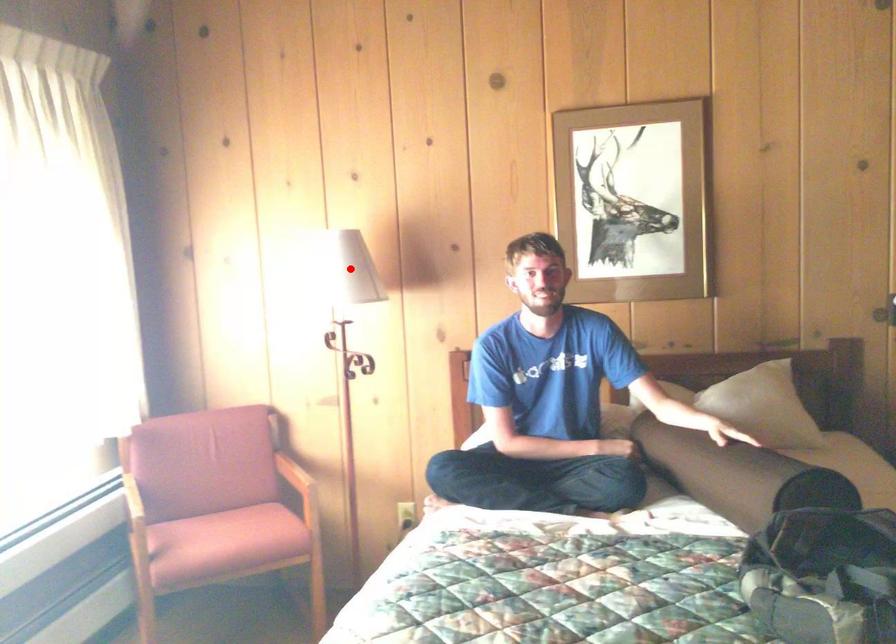
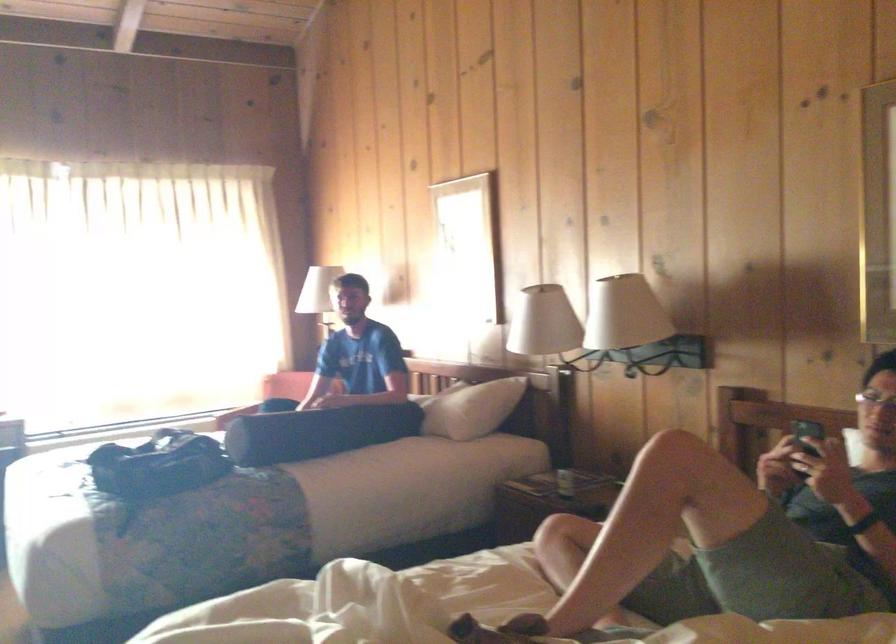
Question: I am providing you with two images of the same scene from different viewpoints. A red point is marked on the first image. At the location where the point appears in image 1, is it still visible in image 2?

Choices:
 (A) Yes
 (B) No

Answer: (B)